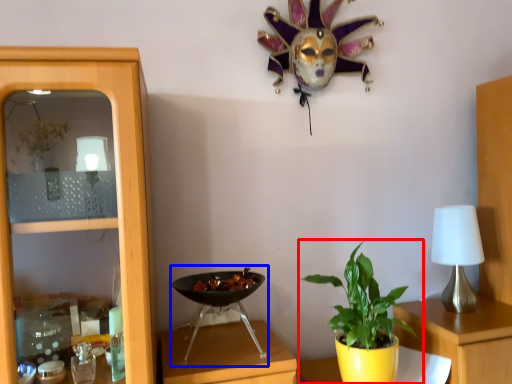
Question: Which point is closer to the camera, houseplant (highlighted by a red box) or wok (highlighted by a blue box)?

Choices:
 (A) houseplant
 (B) wok

Answer: (B)